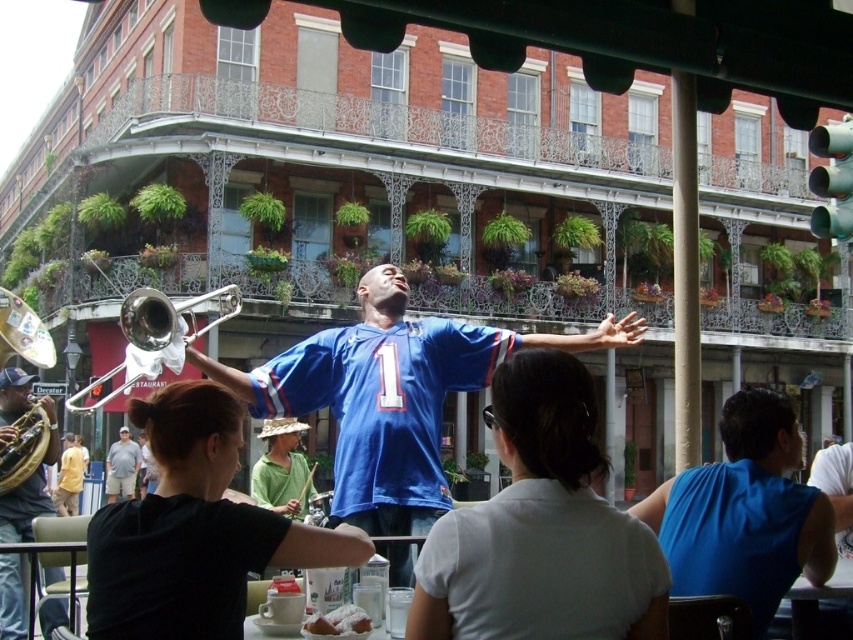
What do you see at coordinates (120, 467) in the screenshot? This screenshot has height=640, width=853. I see `khaki shorts at lower left` at bounding box center [120, 467].

Is point (125, 492) closer to viewer compared to point (71, 444)?

That is True.

In order to click on khaki shorts at lower left in this screenshot , I will do `click(120, 467)`.

Can you confirm if blue jersey at center is bigger than blue sleeveless shirt at right?

Indeed, blue jersey at center has a larger size compared to blue sleeveless shirt at right.

Is point (260, 401) closer to viewer compared to point (761, 582)?

No, it is behind (761, 582).

Who is more distant from viewer, [404,410] or [705,483]?

Point [404,410]

Find the location of a particular element. This screenshot has height=640, width=853. blue jersey at center is located at coordinates (392, 396).

Can you confirm if blue jersey at center is thinner than yellow cotton shirt at lower left?

No.

Is blue jersey at center taller than yellow cotton shirt at lower left?

Yes, blue jersey at center is taller than yellow cotton shirt at lower left.

Does point (247, 387) come behind point (71, 468)?

No, (247, 387) is in front of (71, 468).

Where is `blue jersey at center`? blue jersey at center is located at coordinates (392, 396).